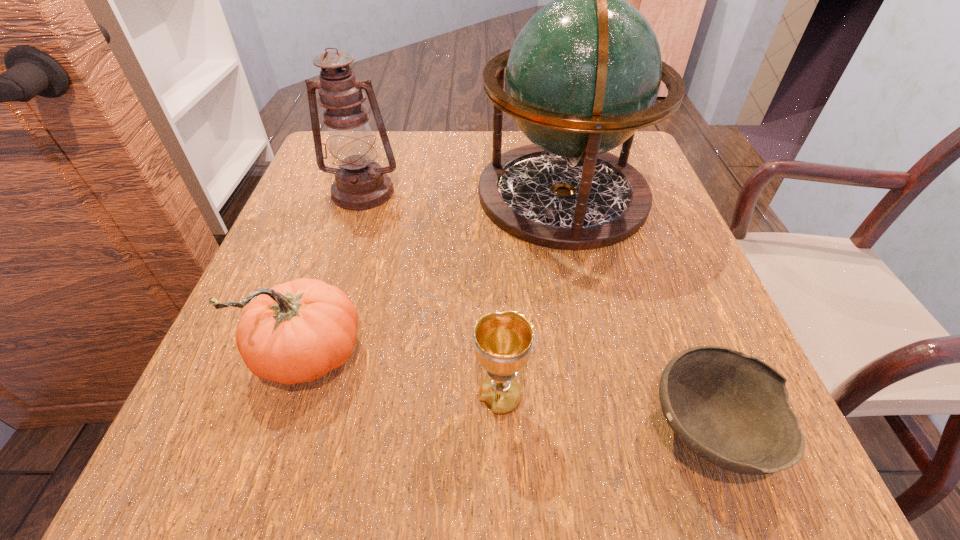
Identify the location of vacant point located between the globe and the pumpkin. This screenshot has width=960, height=540. (436, 276).

What are the coordinates of `free space between the fourth shortest object and the third shortest object` in the screenshot? It's located at (336, 275).

This screenshot has height=540, width=960. In order to click on empty space that is in between the globe and the fourth shortest object in this screenshot , I will do `click(463, 193)`.

Identify the location of free space between the tallest object and the second tallest object. (463, 193).

Where is `free space between the oil lamp and the bowl`? Image resolution: width=960 pixels, height=540 pixels. free space between the oil lamp and the bowl is located at coordinates (536, 311).

Identify the location of vacant space that's between the shortest object and the tallest object. The image size is (960, 540). (636, 312).

This screenshot has height=540, width=960. What are the coordinates of `vacant area that lies between the chalice and the shortest object` in the screenshot? It's located at (604, 413).

Where is `the third closest object relative to the pumpkin`? This screenshot has height=540, width=960. the third closest object relative to the pumpkin is located at coordinates (360, 183).

Point out which object is positioned as the third nearest to the second shortest object. Please provide its 2D coordinates. Your answer should be formatted as a tuple, i.e. [(x, y)], where the tuple contains the x and y coordinates of a point satisfying the conditions above.

[(582, 76)]

This screenshot has width=960, height=540. What are the coordinates of `free spot that satisfies the following two spatial constraints: 1. on the front side of the shortest object; 2. on the left side of the pumpkin` in the screenshot? It's located at (286, 430).